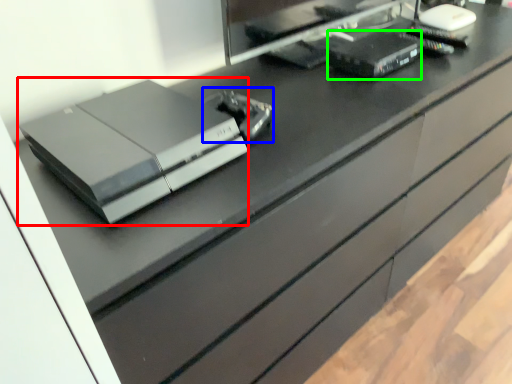
Question: Estimate the real-world distances between objects in this image. Which object is closer to printer (highlighted by a red box), equipment (highlighted by a blue box) or equipment (highlighted by a green box)?

Choices:
 (A) equipment
 (B) equipment

Answer: (A)